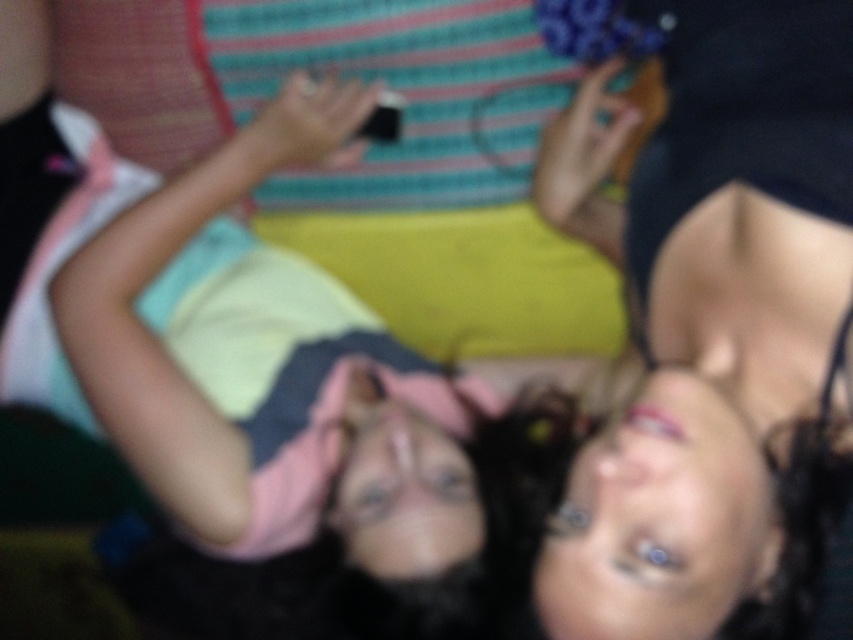
Question: Which of the following is the closest to the observer?

Choices:
 (A) (419, 227)
 (B) (646, 209)

Answer: (B)

Question: Can you confirm if smooth skin face at upper center is positioned to the left of pink fabric at center?

Choices:
 (A) no
 (B) yes

Answer: (A)

Question: Can you confirm if smooth skin face at upper center is bigger than pink fabric at center?

Choices:
 (A) no
 (B) yes

Answer: (A)

Question: Which point is farther from the camera taking this photo?

Choices:
 (A) (692, 3)
 (B) (219, 256)

Answer: (B)

Question: Can you confirm if smooth skin face at upper center is wider than pink fabric at center?

Choices:
 (A) yes
 (B) no

Answer: (B)

Question: Which of the following is the farthest from the observer?

Choices:
 (A) (77, 243)
 (B) (726, 252)

Answer: (A)